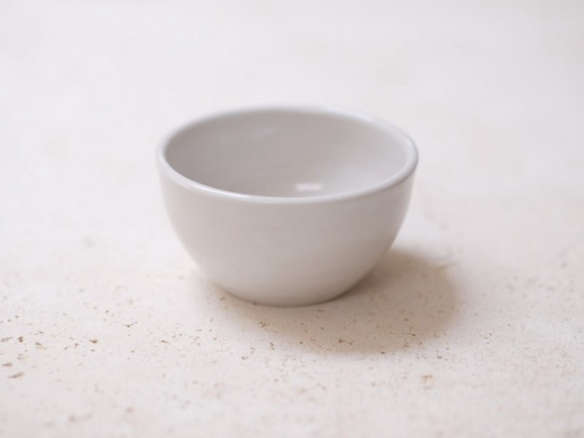
Find the location of a particular element. teacup is located at coordinates (312, 253).